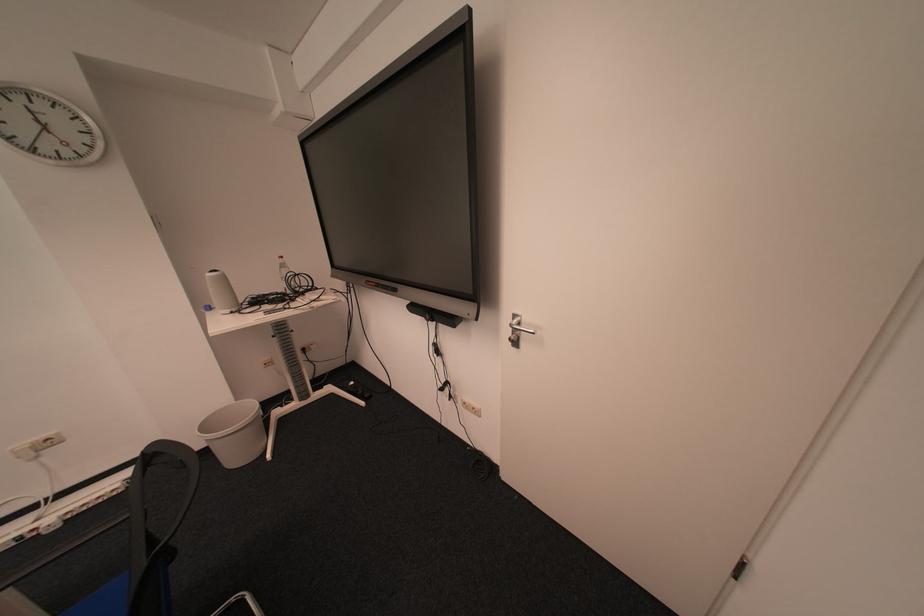
Locate an element on the screen. This screenshot has width=924, height=616. blue chair sitting surface is located at coordinates (110, 601).